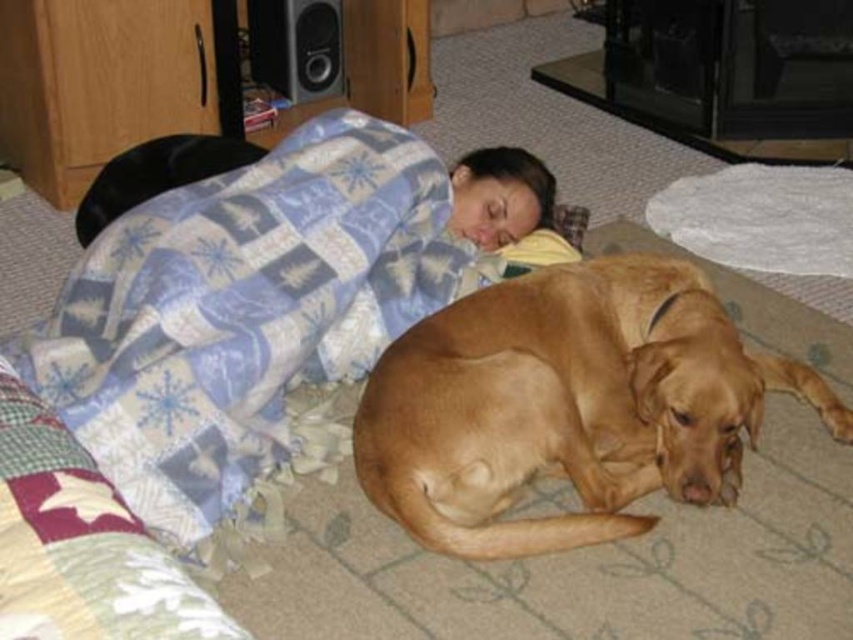
You are a photographer standing in front of the bed. You want to take a closeup photo of the blue plaid blanket at upper center. Can you reach it with your camera without moving the bed or blanket?

The blue plaid blanket at upper center is 1.71 meters from camera, so yes, you can reach it with your camera since 1.71 meters is within a typical camera lens range for closeup photos without needing to move the bed or blanket.

You are standing in the room and want to reach both the point at coordinates (312,176) and the point at coordinates (474,477). Which point will you reach first if you move straight towards them?

You will reach the point at coordinates (312,176) first because it is closer to you than the point at coordinates (474,477), which is further away.